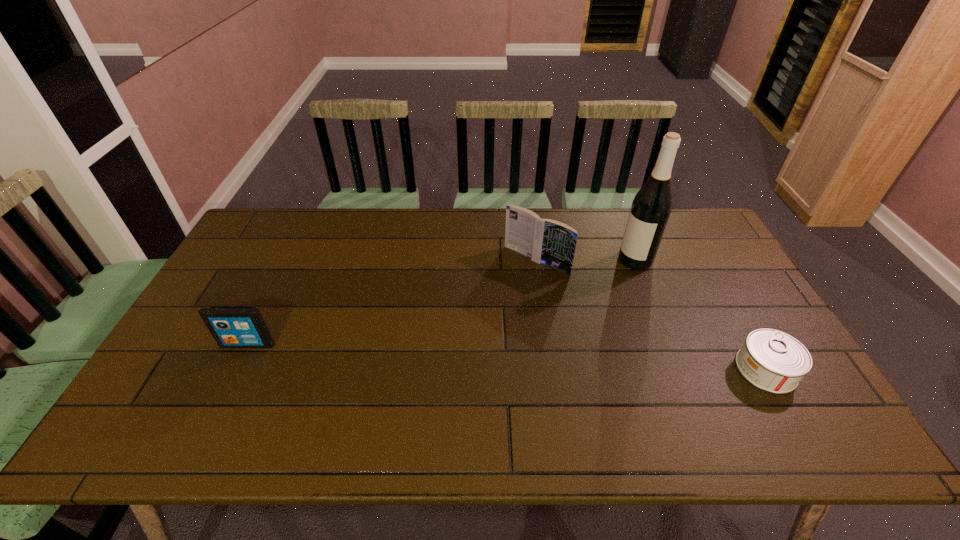
Where is `vacant space on the desktop that is between the iPod and the can and is positioned on the label of the wine bottle`? This screenshot has height=540, width=960. vacant space on the desktop that is between the iPod and the can and is positioned on the label of the wine bottle is located at coordinates (519, 357).

Find the location of a particular element. The image size is (960, 540). vacant spot on the desktop that is between the iPod and the shortest object and is positioned on the front cover of the third object from right to left is located at coordinates (444, 354).